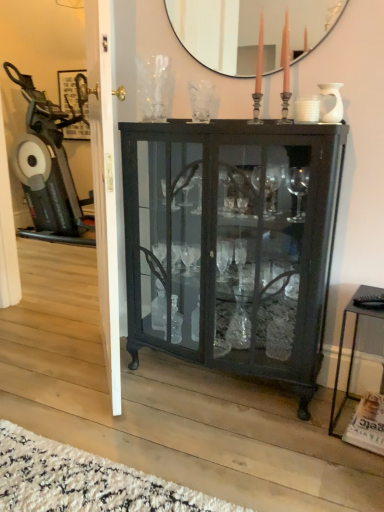
At what (x,y) coordinates should I click in order to perform the action: click on free space to the left of white glossy door at center. Please return your answer as a coordinate pair (x, y). Image resolution: width=384 pixels, height=512 pixels. Looking at the image, I should click on (47, 364).